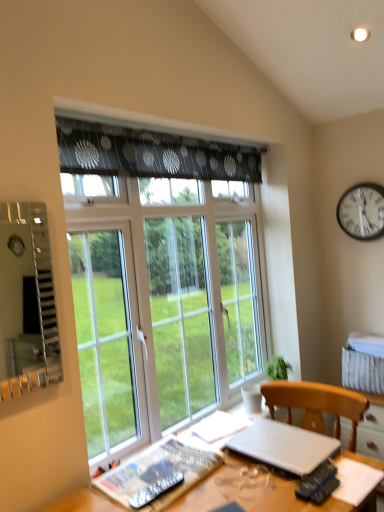
Find the location of a particular element. Image resolution: width=384 pixels, height=512 pixels. vacant area on top of silver metallic laptop at lower right (from a real-world perspective) is located at coordinates (284, 444).